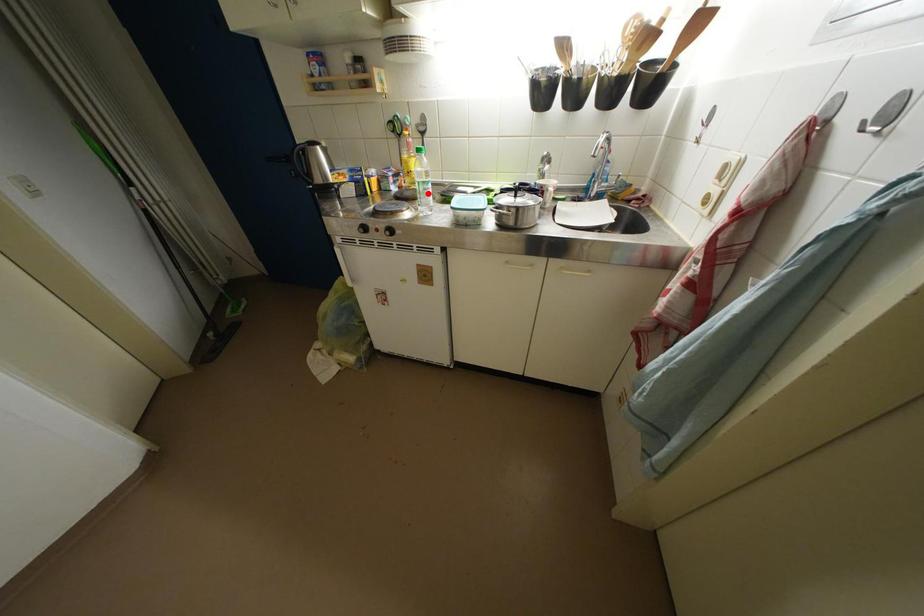
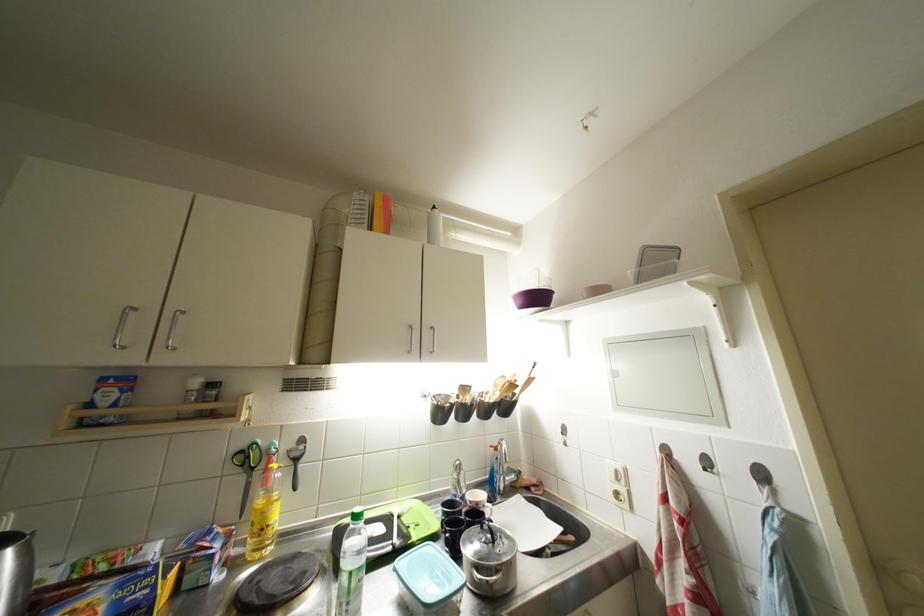
In the second image, find the point that corresponds to the highlighted location in the first image.

(359, 589)